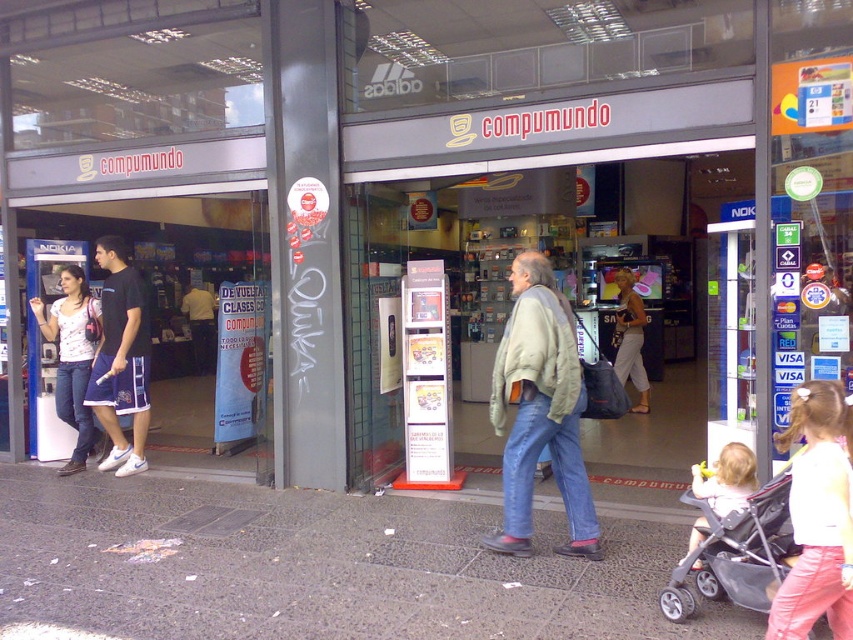
You are a customer entering the Compumundo store and see a gray fabric stroller at lower right and a yellow shirt at center. Which object takes up more space in the entrance area?

The yellow shirt at center takes up more space than the gray fabric stroller at lower right because the gray fabric stroller at lower right occupies less space than yellow shirt at center.